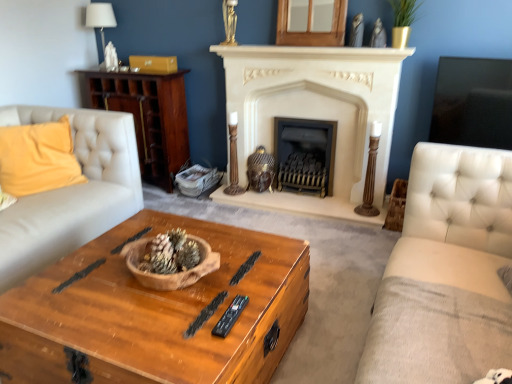
The width and height of the screenshot is (512, 384). What are the coordinates of `free region on the left part of brown textured pine cone at center` in the screenshot? It's located at tap(111, 269).